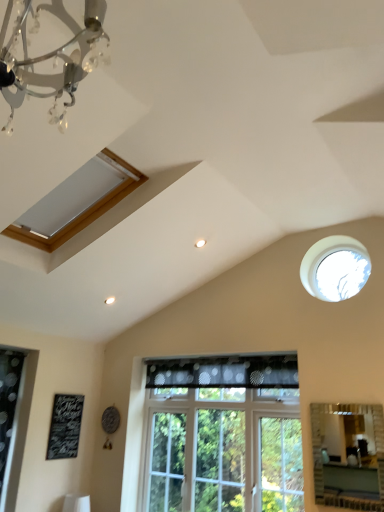
Question: Would you say clear glass window at center, the 2th window when ordered from left to right, is to the left or to the right of matte silver mirror at lower right in the picture?

Choices:
 (A) left
 (B) right

Answer: (A)

Question: From the image's perspective, is clear glass window at center, the 2th window when ordered from left to right, above or below matte silver mirror at lower right?

Choices:
 (A) above
 (B) below

Answer: (B)

Question: Based on their relative distances, which object is farther from the matte silver mirror at lower right?

Choices:
 (A) transparent glass window at upper right, which is counted as the 1th window, starting from the right
 (B) black dotted fabric at center
 (C) black chalkboard at lower left
 (D) matte wooden window at upper left, the 3th window viewed from the right
 (E) clear glass window at center, the 2th window when ordered from left to right

Answer: (C)

Question: Based on their relative distances, which object is farther from the clear glass window at center, the 1th window when ordered from bottom to top?

Choices:
 (A) black chalkboard at lower left
 (B) matte silver mirror at lower right
 (C) transparent glass window at upper right, which is the 3th window in left-to-right order
 (D) matte wooden window at upper left, which ranks as the first window in left-to-right order
 (E) black dotted fabric at center

Answer: (D)